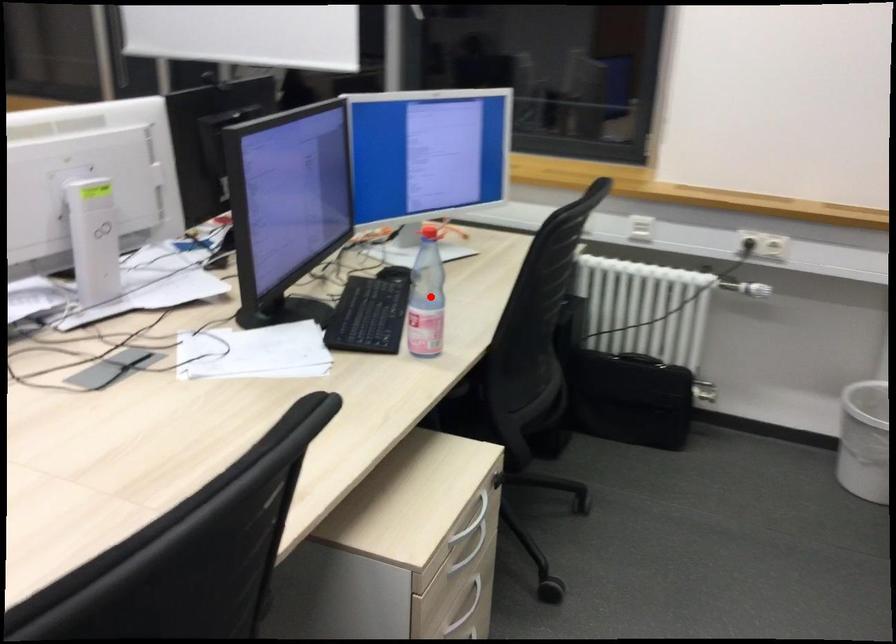
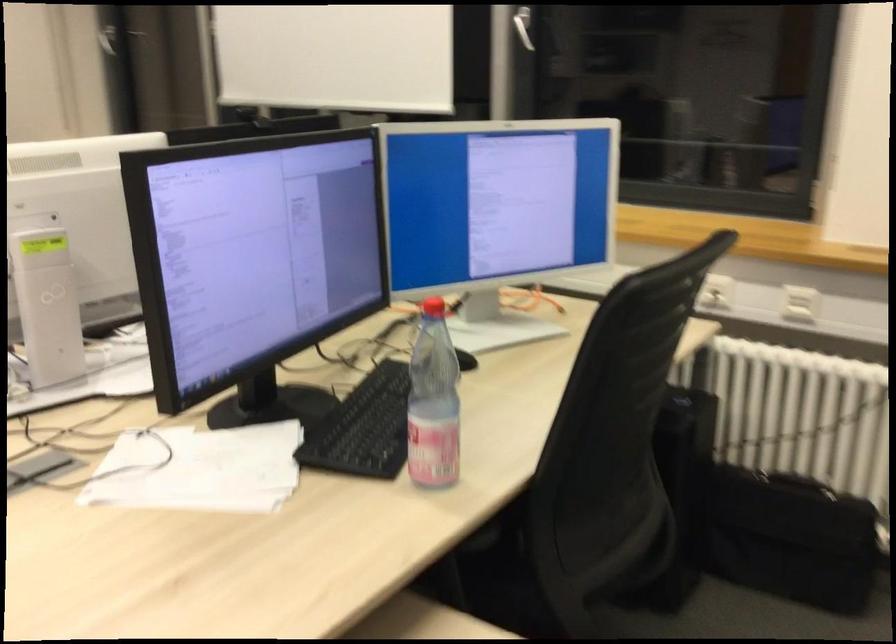
Question: I am providing you with two images of the same scene from different viewpoints. Given a red point in image1, look at the same physical point in image2. Is it:

Choices:
 (A) Closer to the viewpoint
 (B) Farther from the viewpoint

Answer: (A)